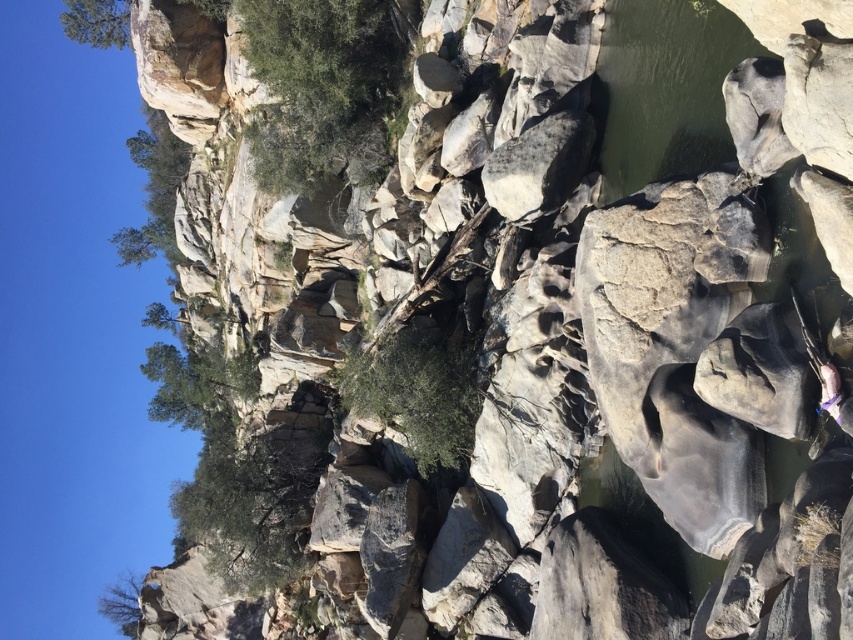
You are standing at the center of the rocky landscape and want to determine which object is taller between the green smooth water at upper right and the green leafy tree at upper left. Based on the scene, which one is taller?

The green smooth water at upper right is taller than the green leafy tree at upper left according to the description.

You are a hiker who wants to cross the green smooth water at upper right. You have a rope that is 130 feet long. Can you safely reach the other side using the rope?

The green smooth water at upper right is 136.72 feet away from camera. Since the rope is only 130 feet long, it is not long enough to safely reach the other side.